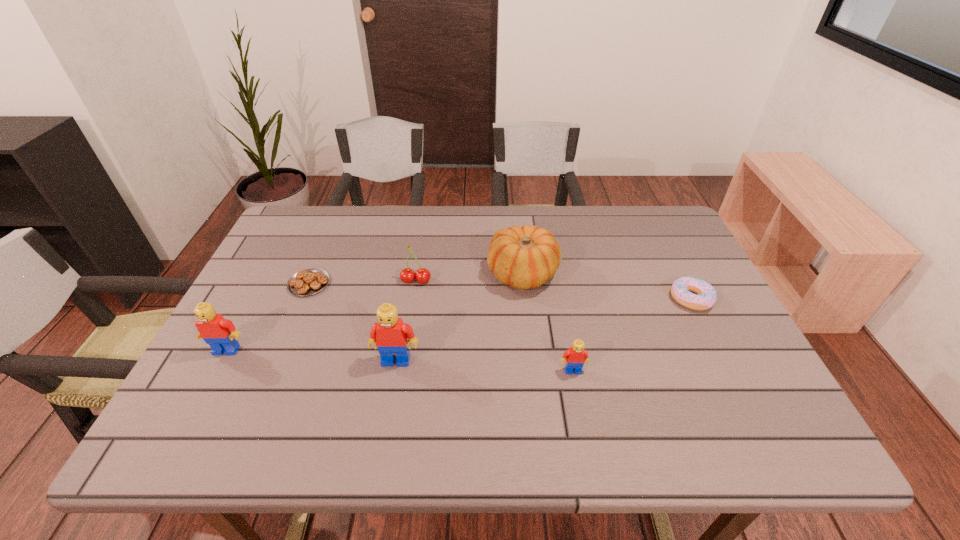
This screenshot has height=540, width=960. Identify the location of vacant spot to place a Lego on the right. (757, 381).